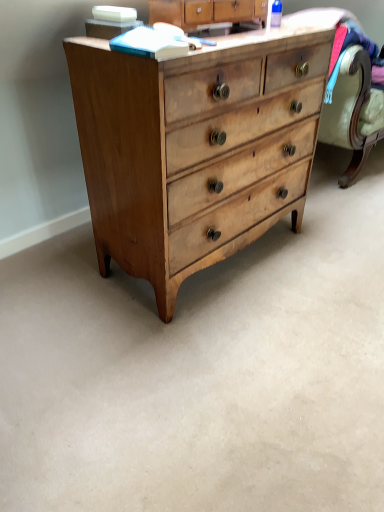
Find the location of a particular element. The height and width of the screenshot is (512, 384). free location in front of light brown wood chest of drawers at center is located at coordinates (213, 361).